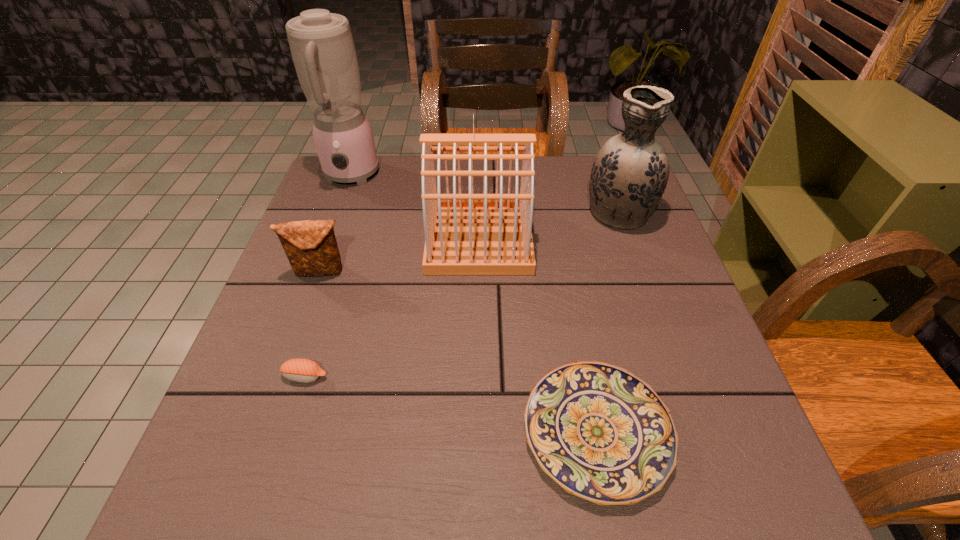
At what (x,y) coordinates should I click in order to perform the action: click on vacant space that is in between the birdcage and the shortest object. Please return your answer as a coordinate pair (x, y). The width and height of the screenshot is (960, 540). Looking at the image, I should click on pos(538,335).

Image resolution: width=960 pixels, height=540 pixels. Find the location of `vacant space in between the vase and the shortest object`. vacant space in between the vase and the shortest object is located at coordinates (608, 321).

This screenshot has width=960, height=540. I want to click on vacant space that's between the third shortest object and the sushi, so click(313, 324).

What are the coordinates of `free spot between the shortest object and the vase` in the screenshot? It's located at (608, 321).

In order to click on unoccupied area between the birdcage and the plate in this screenshot , I will do `click(538, 335)`.

You are a GUI agent. You are given a task and a screenshot of the screen. Output one action in this format:
    pyautogui.click(x=<x>, y=<y>)
    Task: Click on the blank region between the third shortest object and the birdcage
    This screenshot has height=540, width=960.
    Given the screenshot: What is the action you would take?
    pyautogui.click(x=400, y=255)

Where is `empty space between the clutch bag and the food processor`? This screenshot has width=960, height=540. empty space between the clutch bag and the food processor is located at coordinates (336, 224).

I want to click on free space between the clutch bag and the plate, so click(x=459, y=352).

At what (x,y) coordinates should I click in order to perform the action: click on the fourth closest object to the clutch bag. Please return your answer as a coordinate pair (x, y). The height and width of the screenshot is (540, 960). Looking at the image, I should click on (601, 433).

In order to click on object that is the closest to the sushi in this screenshot , I will do `click(311, 247)`.